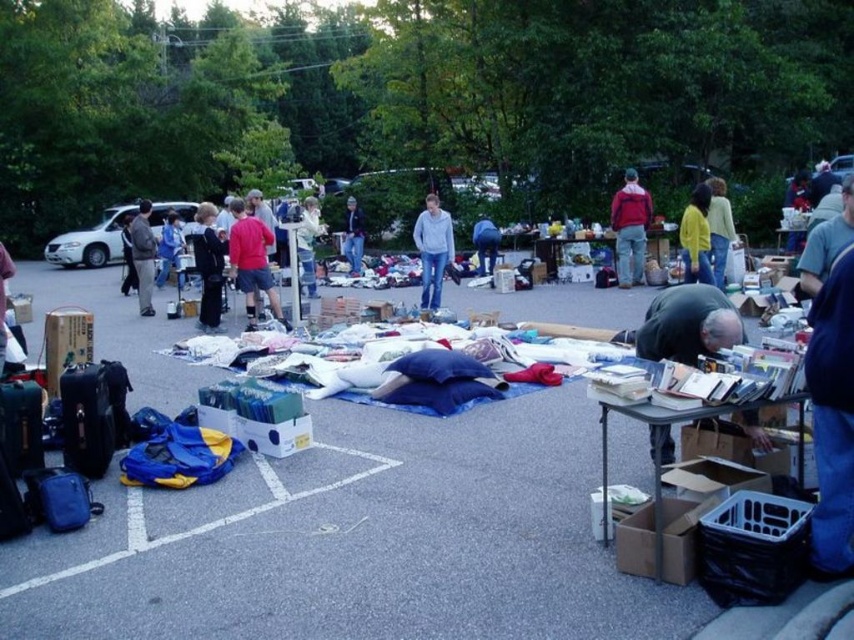
Who is more forward, (156, 564) or (80, 243)?

Point (156, 564)

Locate an element on the screen. blue fabric pillows at center is located at coordinates pos(358,541).

At what (x,y) coordinates should I click in order to perform the action: click on white cotton shirt at center. Please return your answer as a coordinate pair (x, y). The height and width of the screenshot is (640, 854). Looking at the image, I should click on (308, 243).

Does point (313, 285) lie in front of point (360, 266)?

Yes, point (313, 285) is closer to viewer.

Does point (301, 211) lie in front of point (357, 241)?

No, it is not.

The image size is (854, 640). I want to click on white cotton shirt at center, so click(308, 243).

Does white cotton shirt at center have a larger size compared to blue denim jacket at center?

No.

Locate an element on the screen. white cotton shirt at center is located at coordinates (308, 243).